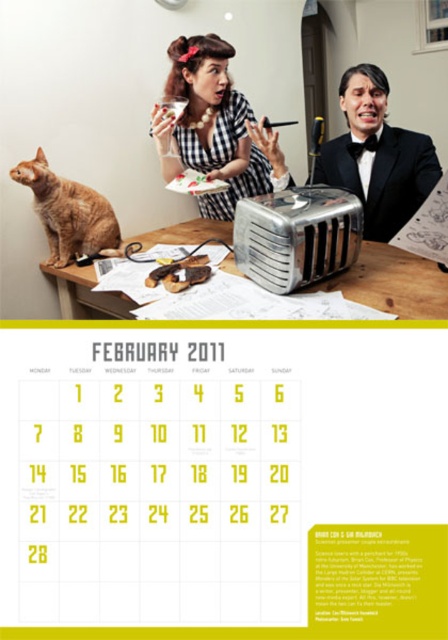
You are organizing a charity event and need to display both the glossy black dress at center and the silver metallic toaster at center on a table. Given their sizes, which object will require more table space?

The glossy black dress at center requires more table space because it has a larger size compared to the silver metallic toaster at center.

Where is the glossy black dress at center located in the image?

The glossy black dress at center is located at point 0.197 on the x axis and 0.467 on the y axis.

In the top half of the image, there is a woman in a glossy black dress at center and an orange fur cat at left. Which object is positioned to the right of the other?

The glossy black dress at center is to the right of the orange fur cat at left.